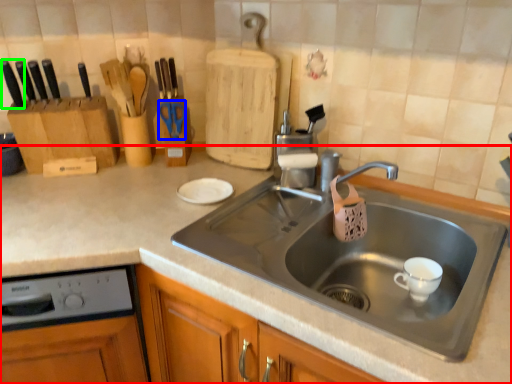
Question: Based on their relative distances, which object is farther from countertop (highlighted by a red box)? Choose from scissors (highlighted by a blue box) and knife (highlighted by a green box).

Choices:
 (A) scissors
 (B) knife

Answer: (B)